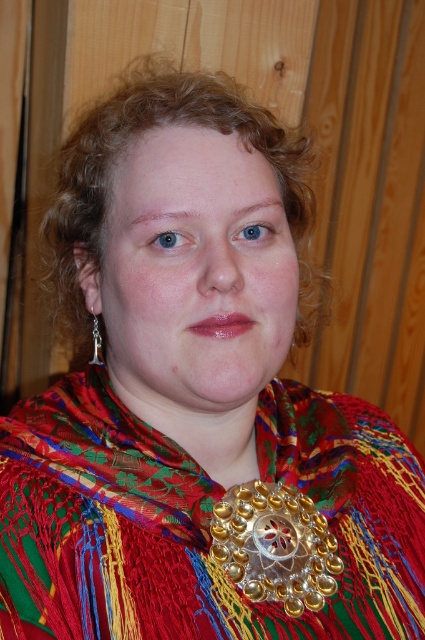
You are standing in front of the person wearing the traditional attire. You notice a point at coordinates (198,520). What object is located at this point?

The multicolored woven scarf at center is located at point (198,520).

You are an assistant helping someone dress for a cultural event. They have a multicolored woven scarf at center and a gold metallic necklace at center. Which accessory is more visible from the front?

The multicolored woven scarf at center is more visible from the front because it is in front of the gold metallic necklace at center.

You are standing in front of the person wearing the vibrant multicolored garment. There are two points marked on their attire. One is at coordinates point (62, 192) and the other at point (269, 531). Which of these points is closer to you?

Point (62, 192) is closer to you because it is further to the viewer than point (269, 531).